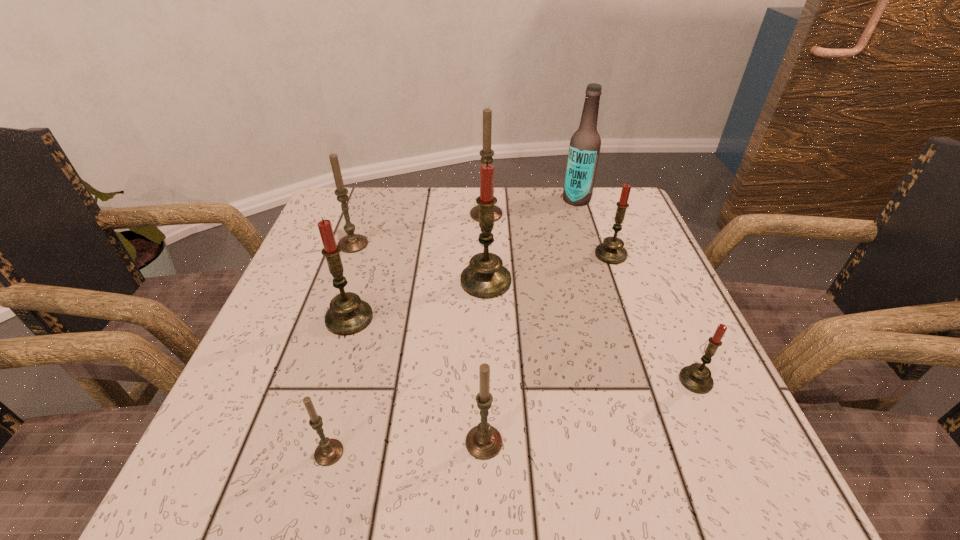
This screenshot has width=960, height=540. Find the location of `beer bottle`. beer bottle is located at coordinates (585, 143).

Where is `the fifth farthest object`? the fifth farthest object is located at coordinates (485, 277).

Where is `the second farthest red candle`? the second farthest red candle is located at coordinates (485, 277).

What are the coordinates of `the farthest candle` in the screenshot? It's located at (486, 153).

Locate an element on the screen. the farthest gray candle is located at coordinates (486, 153).

The height and width of the screenshot is (540, 960). Identify the location of the fifth farthest candle. (348, 314).

Where is `the third smallest red candle`? The height and width of the screenshot is (540, 960). the third smallest red candle is located at coordinates (348, 314).

Find the location of a particular element. This screenshot has width=960, height=540. the second biggest gray candle is located at coordinates (352, 243).

Where is `the leftmost gray candle`? the leftmost gray candle is located at coordinates (352, 243).

You are a GUI agent. You are given a task and a screenshot of the screen. Output one action in this format:
    pyautogui.click(x=<x>, y=<y>)
    Task: Click on the second red candle from right to left
    
    Given the screenshot: What is the action you would take?
    pyautogui.click(x=611, y=251)